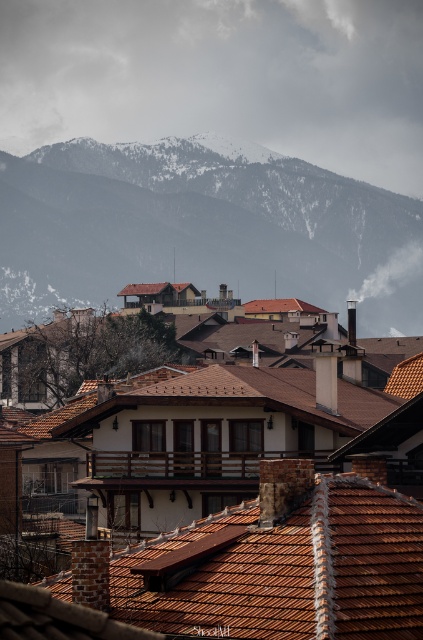
You are standing in the town square and see two points in the image, point (x=376, y=118) and point (x=286, y=240). Which point is closer to you?

Point (x=286, y=240) is closer to you because it is less far than point (x=376, y=118).